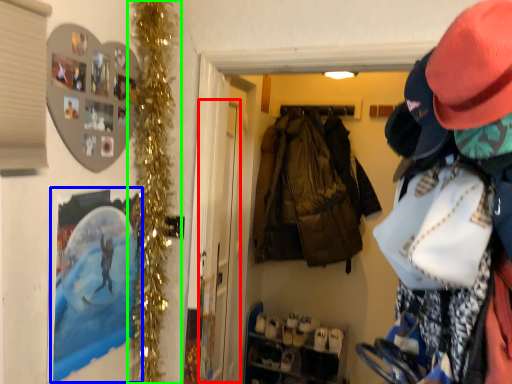
Question: Which is farther away from screen door (highlighted by a red box)? picture frame (highlighted by a blue box) or christmas decoration (highlighted by a green box)?

Choices:
 (A) picture frame
 (B) christmas decoration

Answer: (A)